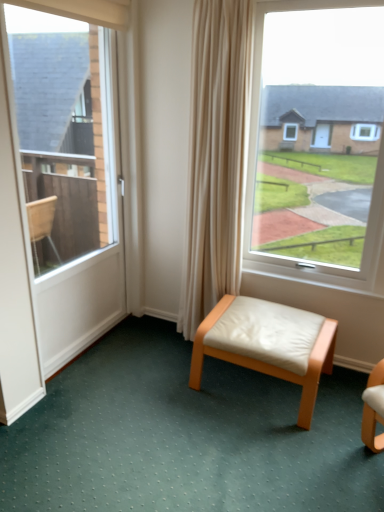
You are a GUI agent. You are given a task and a screenshot of the screen. Output one action in this format:
    pyautogui.click(x=<x>, y=<y>)
    Task: Click on the white glossy door at left
    
    Given the screenshot: What is the action you would take?
    pyautogui.click(x=83, y=284)

This screenshot has height=512, width=384. Identify the location of white glossy door at left. (83, 284).

What's the angular difference between white leather stool at center and white glossy door at left's facing directions?

There is a 91.1-degree angle between the facing directions of white leather stool at center and white glossy door at left.

From the image's perspective, is white leather stool at center below white glossy door at left?

Yes, from the image's perspective, white leather stool at center is beneath white glossy door at left.

Would you say white leather stool at center is inside or outside white glossy door at left?

The correct answer is: outside.

Measure the distance from white leather stool at center to white glossy door at left.

white leather stool at center is 31.88 inches away from white glossy door at left.

Considering the relative positions of white glossy door at left and white leather stool at center in the image provided, is white glossy door at left behind white leather stool at center?

No.

This screenshot has width=384, height=512. In order to click on stool located behind the white glossy door at left in this screenshot , I will do pyautogui.click(x=269, y=364).

In the scene shown: Considering the relative positions of white glossy door at left and white leather stool at center in the image provided, is white glossy door at left to the left or to the right of white leather stool at center?

Based on their positions, white glossy door at left is located to the left of white leather stool at center.

From the image's perspective, does white glossy door at left appear higher than white leather stool at center?

Correct, white glossy door at left appears higher than white leather stool at center in the image.

Which is farther, (305,401) or (234,497)?

Positioned behind is point (305,401).

From the image's perspective, which is above, white leather stool at center or white leather stool at center?

white leather stool at center appears higher in the image.

From a real-world perspective, who is located higher, white leather stool at center or white leather stool at center?

From a 3D spatial view, white leather stool at center is above.

Are white leather stool at center and white leather stool at center located far from each other?

That's not correct — white leather stool at center is a little close to white leather stool at center.

What's the angular difference between white leather stool at center and white leather stool at center's facing directions?

1.45 degrees.

From the image's perspective, which one is positioned higher, white leather stool at center or white leather stool at center?

white leather stool at center is shown above in the image.

Can you confirm if white leather stool at center is smaller than white leather stool at center?

Actually, white leather stool at center might be larger than white leather stool at center.

From a real-world perspective, is white leather stool at center above or below white leather stool at center?

white leather stool at center is situated lower than white leather stool at center in the real world.

Considering the sizes of objects white glossy door at left and white leather stool at center in the image provided, who is taller, white glossy door at left or white leather stool at center?

white glossy door at left.

Is white glossy door at left next to white leather stool at center?

No, white glossy door at left is not touching white leather stool at center.

Would you say white glossy door at left contains white leather stool at center?

No, white leather stool at center is not a part of white glossy door at left.

From the image's perspective, does white leather stool at center appear higher than white glossy door at left?

Answer: No.

Is white leather stool at center positioned with its back to white glossy door at left?

No, white leather stool at center is not facing away from white glossy door at left.

Identify the location of stool that is under the white glossy door at left (from a real-world perspective). This screenshot has height=512, width=384. (269, 364).

From a real-world perspective, which is physically above, white leather stool at center or white glossy door at left?

white glossy door at left is physically above.

You are a GUI agent. You are given a task and a screenshot of the screen. Output one action in this format:
    pyautogui.click(x=<x>, y=<y>)
    Task: Click on the golf course that is below the white glossy door at left (from the image's perspective)
    The height and width of the screenshot is (512, 384).
    Given the screenshot: What is the action you would take?
    pyautogui.click(x=185, y=436)

Locate an element on the screen. stool located underneath the white glossy door at left (from a real-world perspective) is located at coordinates (269, 364).

When comparing their distances from white leather stool at center, does white glossy door at left or white leather stool at center seem closer?

white leather stool at center is positioned closer to the anchor white leather stool at center.

Looking at the image, which one is located closer to white glossy door at left, white leather stool at center or white leather stool at center?

white leather stool at center lies closer to white glossy door at left than the other object.

Looking at the image, which one is located further to white glossy door at left, white leather stool at center or white leather stool at center?

Based on the image, white leather stool at center appears to be further to white glossy door at left.

Which object lies further to the anchor point white leather stool at center, white leather stool at center or white glossy door at left?

white glossy door at left lies further to white leather stool at center than the other object.

From the image, which object appears to be nearer to white leather stool at center, white leather stool at center or white glossy door at left?

white leather stool at center lies closer to white leather stool at center than the other object.

When comparing their distances from white leather stool at center, does white glossy door at left or white leather stool at center seem further?

Based on the image, white glossy door at left appears to be further to white leather stool at center.

Locate an element on the screen. Image resolution: width=384 pixels, height=512 pixels. stool between white glossy door at left and white leather stool at center in the up-down direction is located at coordinates (269, 364).